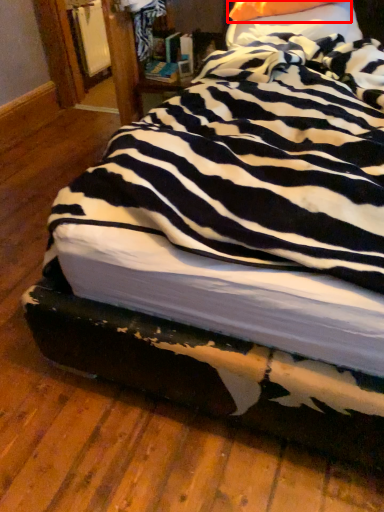
Question: In this image, where is pillow (annotated by the red box) located relative to pillow?

Choices:
 (A) right
 (B) left

Answer: (A)